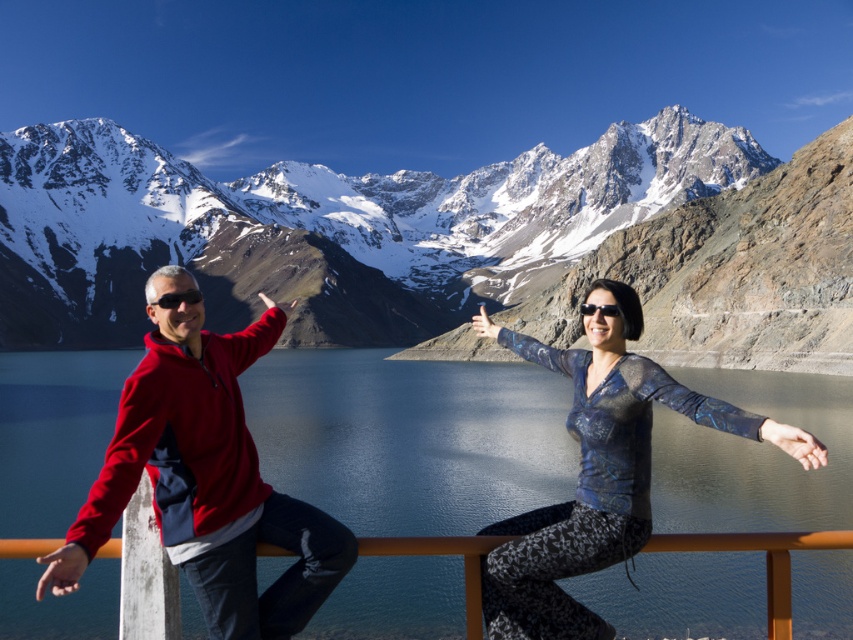
You are standing at the point with coordinates point (579, 316) and want to walk towards the point with coordinates point (233, 554). According to the scene, will you be moving towards the foreground or background of the image?

Point (233, 554) is in front of point (579, 316), so moving towards point (233, 554) would mean moving towards the foreground of the image.

You are designing a photo frame that needs to accommodate both the matte red jacket at left and the metallic blue blouse at center. Since the frame has a fixed width, which object should be placed first to ensure both fit without overlapping?

The matte red jacket at left has a smaller width than the metallic blue blouse at center, so place the metallic blue blouse at center first to allow space for the narrower jacket next to it.